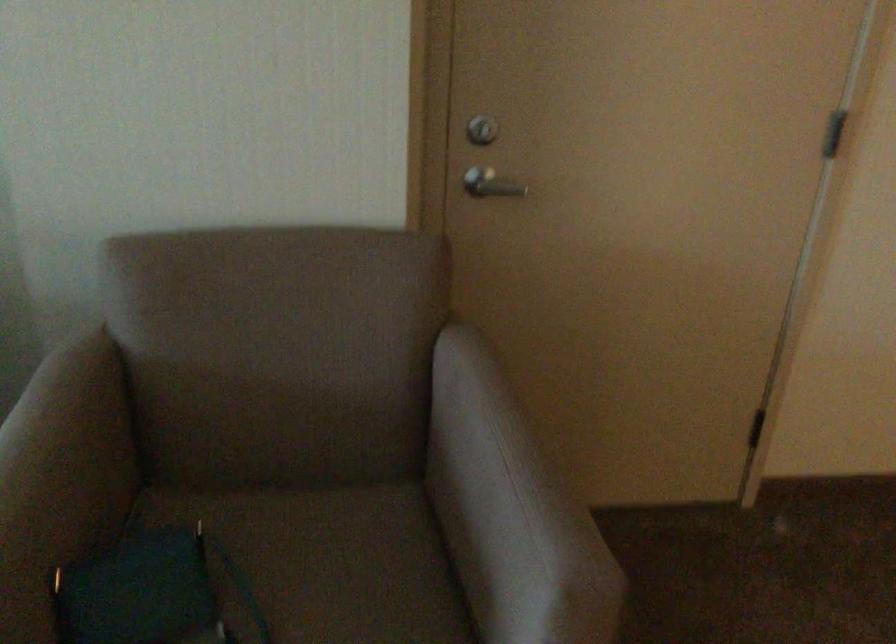
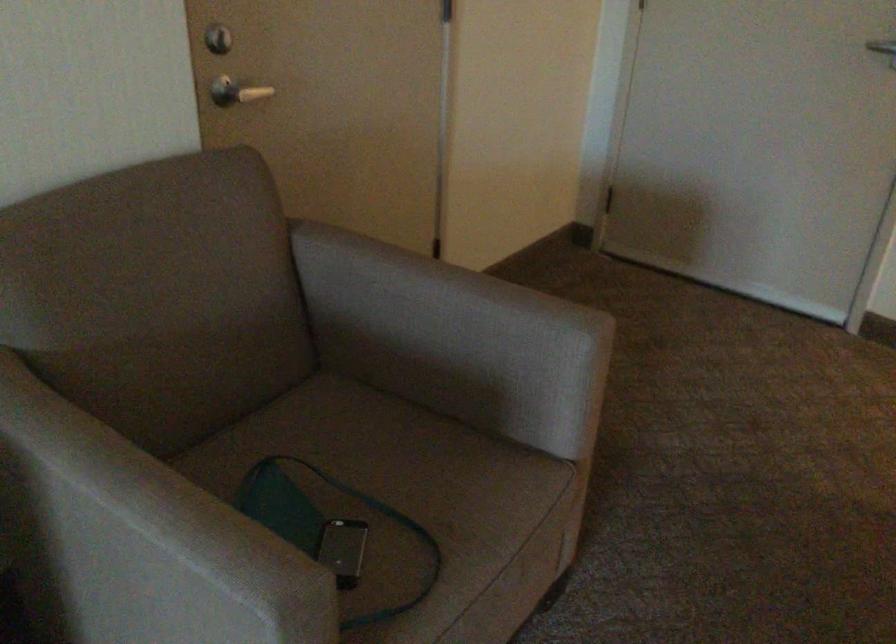
Find the pixel in the second image that matches point (479, 507) in the first image.

(453, 339)